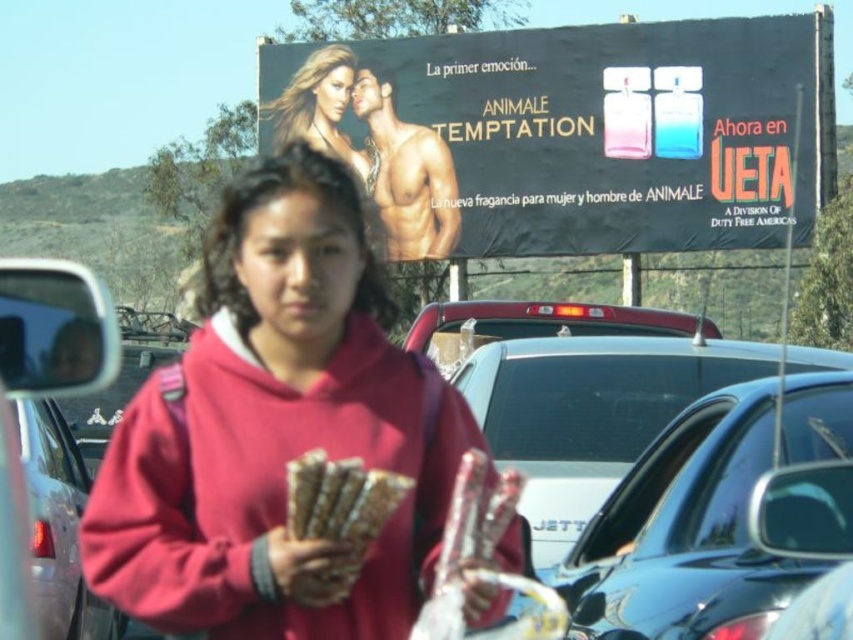
Does metallic silver car at left come behind golden textured sticks at center?

Yes, it is behind golden textured sticks at center.

Who is higher up, metallic silver car at left or golden textured sticks at center?

golden textured sticks at center is higher up.

Between point (51, 448) and point (292, 492), which one is positioned in front?

Point (292, 492)

Where is `metallic silver car at left`? metallic silver car at left is located at coordinates (57, 524).

Is metallic silver car at left wider than matte red car at center?

No.

Is metallic silver car at left to the left of matte red car at center from the viewer's perspective?

Yes, metallic silver car at left is to the left of matte red car at center.

Is point (38, 509) farther from camera compared to point (466, 346)?

No, (38, 509) is in front of (466, 346).

This screenshot has height=640, width=853. What are the coordinates of `metallic silver car at left` in the screenshot? It's located at (57, 524).

Does metallic silver car at left appear over brown textured sticks at center?

Actually, metallic silver car at left is below brown textured sticks at center.

From the picture: Can you confirm if metallic silver car at left is bigger than brown textured sticks at center?

Yes, metallic silver car at left is bigger than brown textured sticks at center.

This screenshot has height=640, width=853. Find the location of `metallic silver car at left`. metallic silver car at left is located at coordinates (57, 524).